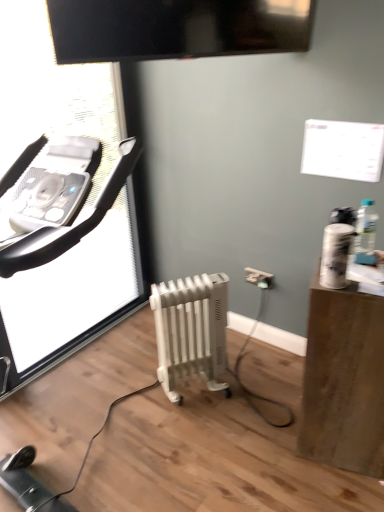
At what (x,y) coordinates should I click in order to perform the action: click on brown wood side table at right. Please return your answer as a coordinate pair (x, y). The image size is (384, 512). Looking at the image, I should click on (344, 380).

Image resolution: width=384 pixels, height=512 pixels. What are the coordinates of `white plastic radiator at center` in the screenshot? It's located at pos(191,330).

Does white plastic radiator at center have a smaller size compared to white plastic electric outlet at lower center?

No, white plastic radiator at center is not smaller than white plastic electric outlet at lower center.

Where is `radiator in front of the white plastic electric outlet at lower center`? radiator in front of the white plastic electric outlet at lower center is located at coordinates (191, 330).

How much distance is there between white plastic radiator at center and white plastic electric outlet at lower center?

A distance of 19.86 inches exists between white plastic radiator at center and white plastic electric outlet at lower center.

Does glossy black tv at upper center have a larger size compared to brown wood side table at right?

No.

Is glossy black tv at upper center not inside brown wood side table at right?

That's correct, glossy black tv at upper center is outside of brown wood side table at right.

Can you confirm if glossy black tv at upper center is shorter than brown wood side table at right?

Yes, glossy black tv at upper center is shorter than brown wood side table at right.

Which is more to the right, glossy black tv at upper center or brown wood side table at right?

brown wood side table at right.

Who is bigger, white plastic electric outlet at lower center or transparent plastic screen door at left?

transparent plastic screen door at left.

From the image's perspective, is white plastic electric outlet at lower center located beneath transparent plastic screen door at left?

Yes, from the image's perspective, white plastic electric outlet at lower center is below transparent plastic screen door at left.

Is transparent plastic screen door at left surrounded by white plastic electric outlet at lower center?

No, transparent plastic screen door at left is not a part of white plastic electric outlet at lower center.

Is white plastic electric outlet at lower center in front of or behind transparent plastic screen door at left in the image?

Visually, white plastic electric outlet at lower center is located behind transparent plastic screen door at left.

Locate an element on the screen. furniture in front of the glossy black tv at upper center is located at coordinates (344, 380).

Between point (370, 384) and point (98, 50), which one is positioned in front?

The point (370, 384) is closer.

Can you confirm if brown wood side table at right is thinner than glossy black tv at upper center?

No, brown wood side table at right is not thinner than glossy black tv at upper center.

Can you tell me how much brown wood side table at right and glossy black tv at upper center differ in facing direction?

The facing directions of brown wood side table at right and glossy black tv at upper center are 32.6 degrees apart.

Are brown wood side table at right and white plastic radiator at center far apart?

Actually, brown wood side table at right and white plastic radiator at center are a little close together.

Considering the positions of objects brown wood side table at right and white plastic radiator at center in the image provided, who is behind, brown wood side table at right or white plastic radiator at center?

white plastic radiator at center is further from the camera.

From the image's perspective, is brown wood side table at right positioned above or below white plastic radiator at center?

Clearly, from the image's perspective, brown wood side table at right is below white plastic radiator at center.

Which of these two, clear plastic bottle at right or white plastic electric outlet at lower center, is bigger?

clear plastic bottle at right.

Is clear plastic bottle at right wider than white plastic electric outlet at lower center?

Yes, clear plastic bottle at right is wider than white plastic electric outlet at lower center.

This screenshot has height=512, width=384. Find the location of `electric outlet below the clear plastic bottle at right (from a real-world perspective)`. electric outlet below the clear plastic bottle at right (from a real-world perspective) is located at coordinates (259, 278).

Which is more to the left, clear plastic bottle at right or white plastic electric outlet at lower center?

white plastic electric outlet at lower center.

Which of these two, transparent plastic screen door at left or clear plastic bottle at right, is thinner?

transparent plastic screen door at left is thinner.

Consider the image. Would you say transparent plastic screen door at left is outside clear plastic bottle at right?

transparent plastic screen door at left is positioned outside clear plastic bottle at right.

Considering the sizes of objects transparent plastic screen door at left and clear plastic bottle at right in the image provided, who is bigger, transparent plastic screen door at left or clear plastic bottle at right?

transparent plastic screen door at left.

In order to click on electric outlet that is behind the white plastic radiator at center in this screenshot , I will do `click(259, 278)`.

Where is `television located above the brown wood side table at right (from a real-world perspective)`? Image resolution: width=384 pixels, height=512 pixels. television located above the brown wood side table at right (from a real-world perspective) is located at coordinates (176, 28).

Looking at this image, considering their positions, is transparent plastic screen door at left positioned closer to brown wood side table at right than white plastic electric outlet at lower center?

white plastic electric outlet at lower center lies closer to brown wood side table at right than the other object.

When comparing their distances from brown wood side table at right, does clear plastic bottle at right or white plastic electric outlet at lower center seem closer?

clear plastic bottle at right is closer to brown wood side table at right.

Based on their spatial positions, is brown wood side table at right or transparent plastic screen door at left further from white plastic electric outlet at lower center?

transparent plastic screen door at left is positioned further to the anchor white plastic electric outlet at lower center.

Looking at the image, which one is located further to white plastic radiator at center, brown wood side table at right or clear plastic bottle at right?

clear plastic bottle at right is further to white plastic radiator at center.

Looking at this image, looking at the image, which one is located further to white plastic electric outlet at lower center, white plastic radiator at center or transparent plastic screen door at left?

Among the two, transparent plastic screen door at left is located further to white plastic electric outlet at lower center.

Estimate the real-world distances between objects in this image. Which object is closer to brown wood side table at right, glossy black tv at upper center or transparent plastic screen door at left?

glossy black tv at upper center lies closer to brown wood side table at right than the other object.

Considering their positions, is white plastic electric outlet at lower center positioned closer to clear plastic bottle at right than glossy black tv at upper center?

Based on the image, white plastic electric outlet at lower center appears to be nearer to clear plastic bottle at right.

Estimate the real-world distances between objects in this image. Which object is further from clear plastic bottle at right, brown wood side table at right or white plastic radiator at center?

Based on the image, white plastic radiator at center appears to be further to clear plastic bottle at right.

This screenshot has height=512, width=384. Identify the location of electric outlet between glossy black tv at upper center and white plastic radiator at center from top to bottom. (259, 278).

At what (x,y) coordinates should I click in order to perform the action: click on television situated between transparent plastic screen door at left and clear plastic bottle at right from left to right. Please return your answer as a coordinate pair (x, y). This screenshot has width=384, height=512. Looking at the image, I should click on coord(176,28).

Identify the location of bottle between glossy black tv at upper center and brown wood side table at right vertically. This screenshot has height=512, width=384. (365, 234).

The height and width of the screenshot is (512, 384). Find the location of `radiator situated between transparent plastic screen door at left and clear plastic bottle at right from left to right`. radiator situated between transparent plastic screen door at left and clear plastic bottle at right from left to right is located at coordinates (191, 330).